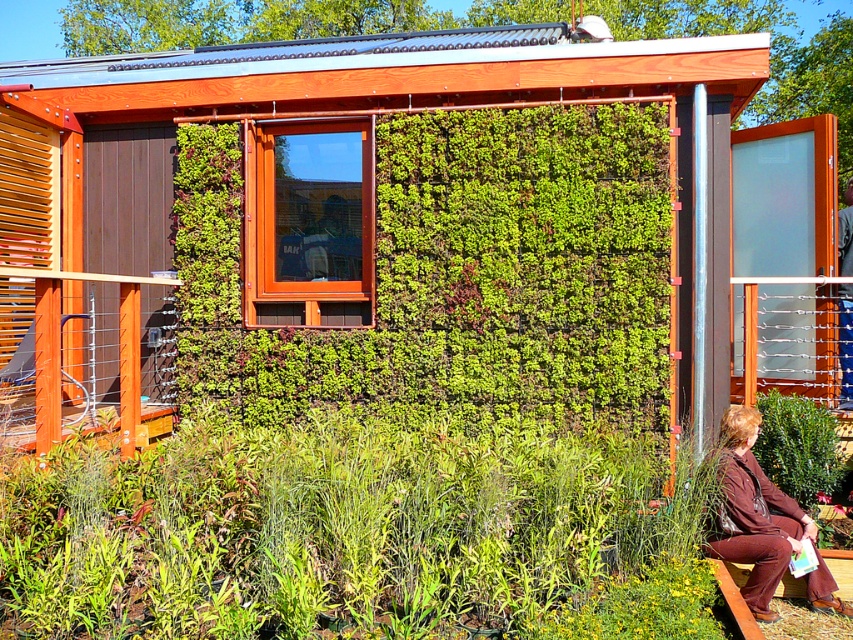
Question: Which point is closer to the camera?

Choices:
 (A) (750, 593)
 (B) (643, 269)

Answer: (A)

Question: Which of the following is the farthest from the observer?

Choices:
 (A) brown fabric at lower right
 (B) green leafy hedge at center

Answer: (B)

Question: Can you confirm if green leafy hedge at center is positioned to the left of brown fabric at lower right?

Choices:
 (A) yes
 (B) no

Answer: (A)

Question: Where is green leafy hedge at center located in relation to brown fabric at lower right in the image?

Choices:
 (A) below
 (B) above

Answer: (B)

Question: Can you confirm if green leafy hedge at center is positioned below brown fabric at lower right?

Choices:
 (A) no
 (B) yes

Answer: (A)